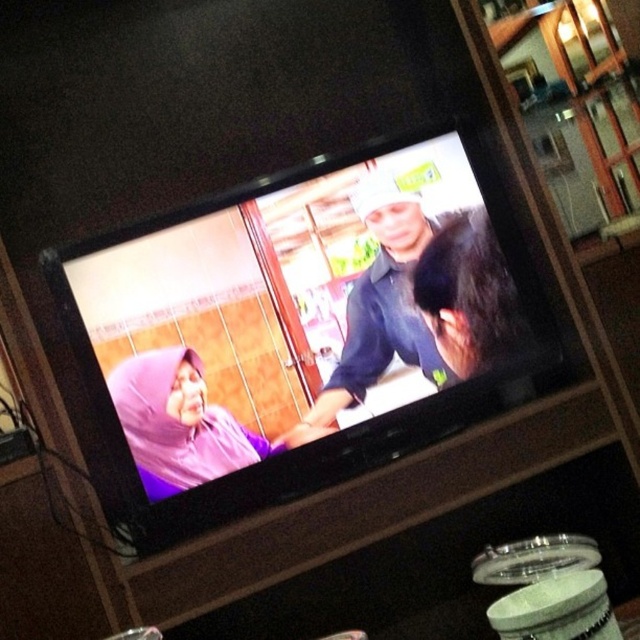
Question: Observing the image, what is the correct spatial positioning of dark blue shirt at center in reference to purple fabric headscarf at center?

Choices:
 (A) left
 (B) right

Answer: (B)

Question: Can you confirm if dark blue shirt at center is thinner than purple fabric headscarf at center?

Choices:
 (A) no
 (B) yes

Answer: (B)

Question: Which point is closer to the camera?

Choices:
 (A) (192, 433)
 (B) (364, 307)

Answer: (A)

Question: Among these objects, which one is farthest from the camera?

Choices:
 (A) purple fabric headscarf at center
 (B) dark blue shirt at center

Answer: (B)

Question: Among these objects, which one is farthest from the camera?

Choices:
 (A) dark blue shirt at center
 (B) purple fabric headscarf at center

Answer: (A)

Question: Does dark blue shirt at center come behind purple fabric headscarf at center?

Choices:
 (A) no
 (B) yes

Answer: (B)